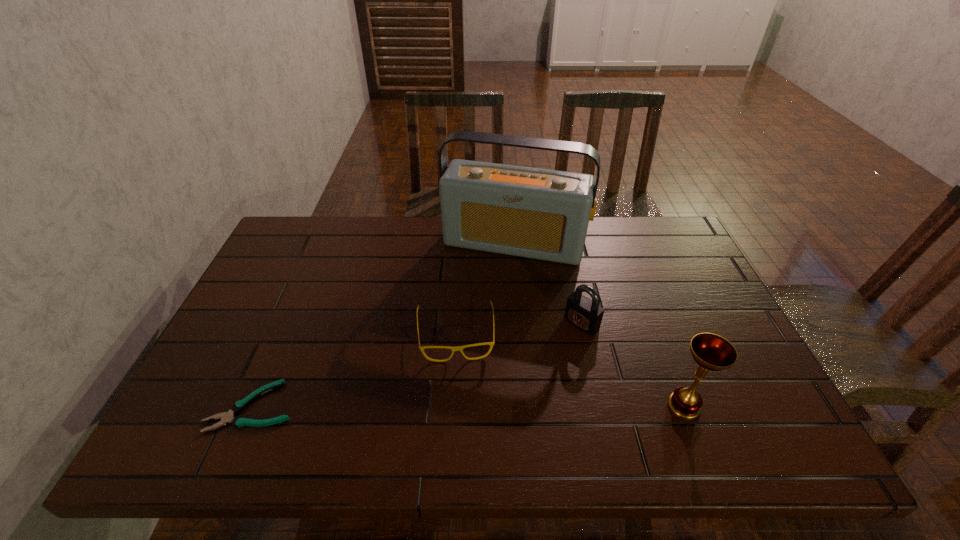
Locate an element on the screen. vacant area that lies between the leftmost object and the spectacles is located at coordinates [354, 370].

This screenshot has width=960, height=540. I want to click on vacant area that lies between the rightmost object and the padlock, so click(633, 364).

Identify which object is located as the nearest to the spectacles. Please provide its 2D coordinates. Your answer should be formatted as a tuple, i.e. [(x, y)], where the tuple contains the x and y coordinates of a point satisfying the conditions above.

[(543, 214)]

Locate which object ranks third in proximity to the pliers. Please provide its 2D coordinates. Your answer should be formatted as a tuple, i.e. [(x, y)], where the tuple contains the x and y coordinates of a point satisfying the conditions above.

[(585, 314)]

This screenshot has width=960, height=540. Find the location of `free point that satisfies the following two spatial constraints: 1. on the back side of the spectacles; 2. on the right side of the farthest object`. free point that satisfies the following two spatial constraints: 1. on the back side of the spectacles; 2. on the right side of the farthest object is located at coordinates (460, 243).

I want to click on free spot that satisfies the following two spatial constraints: 1. on the back side of the rightmost object; 2. on the right side of the pliers, so pos(252,406).